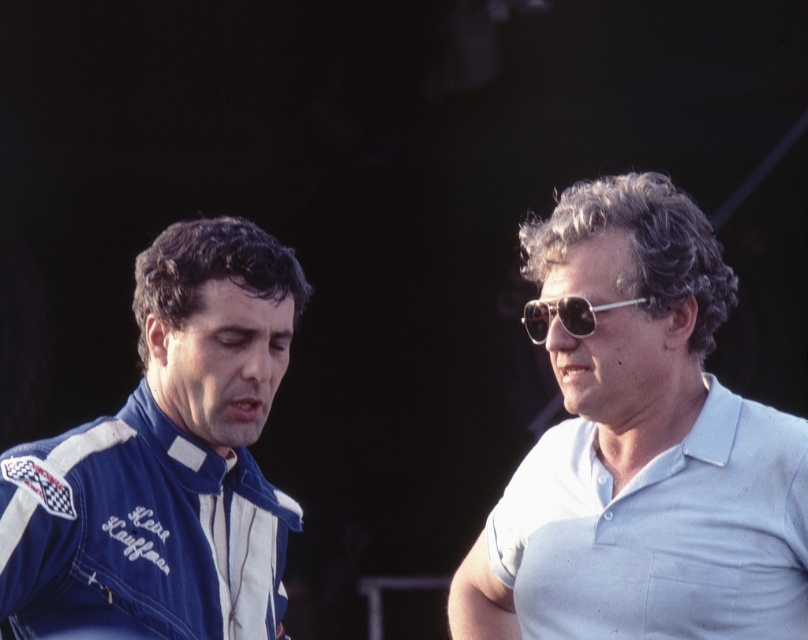
Can you confirm if blue fabric jacket at left is positioned to the right of metallic silver sunglasses at upper right?

No, blue fabric jacket at left is not to the right of metallic silver sunglasses at upper right.

Is blue fabric jacket at left below metallic silver sunglasses at upper right?

Correct, blue fabric jacket at left is located below metallic silver sunglasses at upper right.

Identify the location of blue fabric jacket at left. (167, 460).

Between point (630, 404) and point (543, 323), which one is positioned in front?

Point (630, 404)

Locate an element on the screen. light blue cotton polo shirt at right is located at coordinates (642, 451).

Is light blue cotton polo shirt at right to the right of blue fabric jacket at left from the viewer's perspective?

Correct, you'll find light blue cotton polo shirt at right to the right of blue fabric jacket at left.

Between light blue cotton polo shirt at right and blue fabric jacket at left, which one is positioned higher?

light blue cotton polo shirt at right is above.

Is point (722, 262) closer to camera compared to point (53, 513)?

No, (722, 262) is behind (53, 513).

The height and width of the screenshot is (640, 808). In order to click on light blue cotton polo shirt at right in this screenshot , I will do `click(642, 451)`.